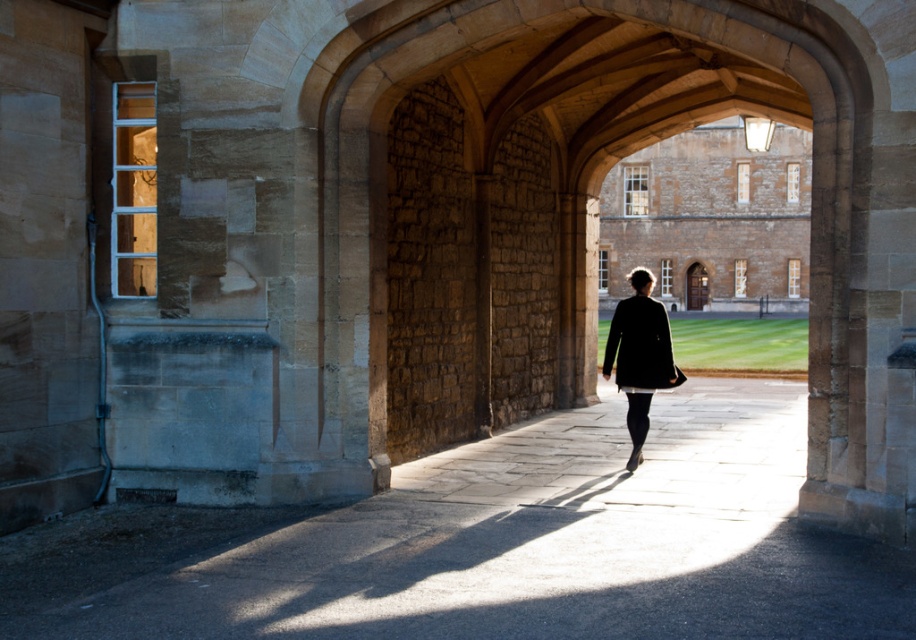
Can you confirm if smooth stone pathway at center is thinner than matte black coat at center?

Correct, smooth stone pathway at center's width is less than matte black coat at center's.

Can you confirm if smooth stone pathway at center is positioned above matte black coat at center?

No.

Is point (784, 467) positioned behind point (628, 358)?

Yes, point (784, 467) is farther from viewer.

The width and height of the screenshot is (916, 640). In order to click on smooth stone pathway at center in this screenshot , I will do `click(495, 545)`.

Between point (677, 378) and point (620, 384), which one is positioned behind?

Positioned behind is point (677, 378).

Which is below, matte black coat at center or black matte coat at center?

black matte coat at center

Where is `matte black coat at center`? The image size is (916, 640). matte black coat at center is located at coordinates (639, 355).

Does point (515, 605) come closer to viewer compared to point (664, 381)?

Yes, it is in front of point (664, 381).

Is smooth stone pathway at center smaller than black matte coat at center?

No, smooth stone pathway at center is not smaller than black matte coat at center.

Find the location of a particular element. This screenshot has height=640, width=916. smooth stone pathway at center is located at coordinates click(x=495, y=545).